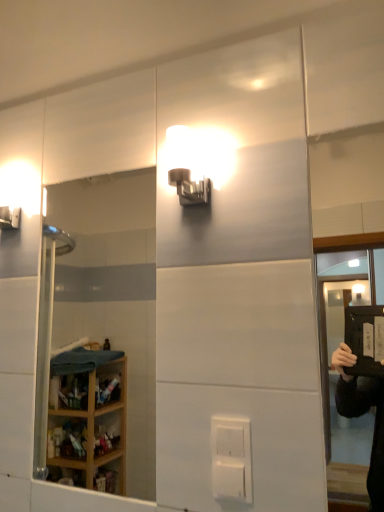
Question: Can you confirm if white plastic electric outlet at center is wider than matte white sconce at upper center?

Choices:
 (A) no
 (B) yes

Answer: (A)

Question: Is white plastic electric outlet at center oriented towards matte white sconce at upper center?

Choices:
 (A) no
 (B) yes

Answer: (A)

Question: Is white plastic electric outlet at center positioned behind matte white sconce at upper center?

Choices:
 (A) yes
 (B) no

Answer: (B)

Question: From a real-world perspective, is white plastic electric outlet at center on top of matte white sconce at upper center?

Choices:
 (A) yes
 (B) no

Answer: (B)

Question: Can you confirm if white plastic electric outlet at center is positioned to the left of matte white sconce at upper center?

Choices:
 (A) yes
 (B) no

Answer: (B)

Question: Is matte white sconce at upper center at the back of white plastic electric outlet at center?

Choices:
 (A) yes
 (B) no

Answer: (B)

Question: Considering the relative positions of transparent plastic screen door at upper right and white plastic electric outlet at center in the image provided, is transparent plastic screen door at upper right to the right of white plastic electric outlet at center from the viewer's perspective?

Choices:
 (A) yes
 (B) no

Answer: (A)

Question: Is transparent plastic screen door at upper right not close to white plastic electric outlet at center?

Choices:
 (A) no
 (B) yes

Answer: (B)

Question: Does transparent plastic screen door at upper right lie behind white plastic electric outlet at center?

Choices:
 (A) no
 (B) yes

Answer: (A)

Question: From a real-world perspective, is transparent plastic screen door at upper right physically below white plastic electric outlet at center?

Choices:
 (A) yes
 (B) no

Answer: (B)

Question: Is transparent plastic screen door at upper right taller than white plastic electric outlet at center?

Choices:
 (A) no
 (B) yes

Answer: (B)

Question: Is transparent plastic screen door at upper right aimed at white plastic electric outlet at center?

Choices:
 (A) no
 (B) yes

Answer: (A)

Question: Considering the relative sizes of clear glass mirror at left and transparent plastic screen door at upper right in the image provided, is clear glass mirror at left bigger than transparent plastic screen door at upper right?

Choices:
 (A) yes
 (B) no

Answer: (A)